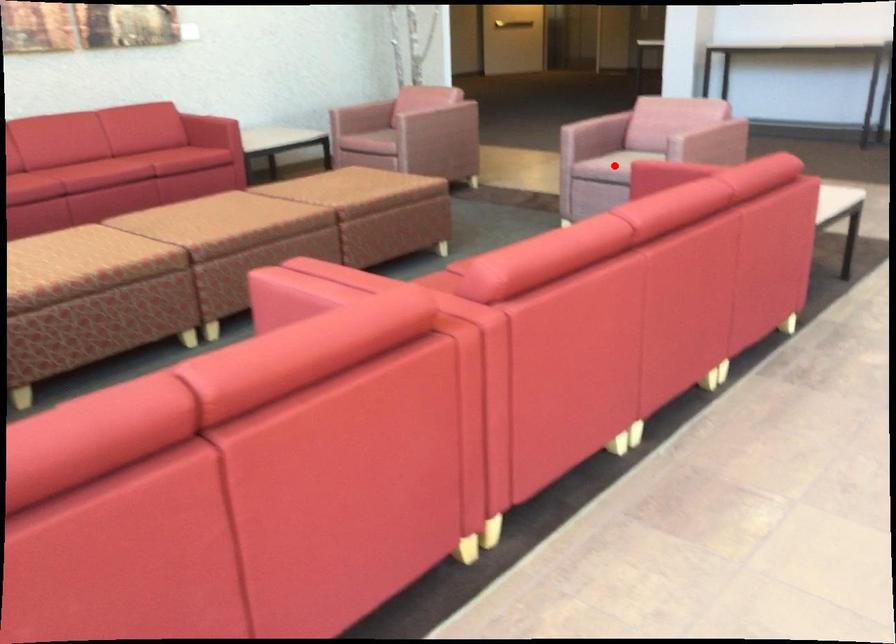
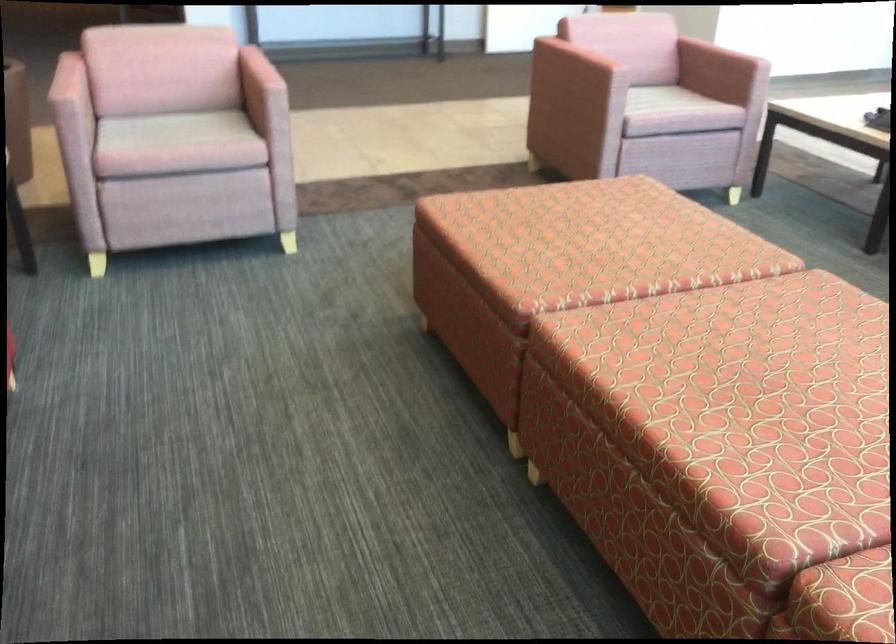
Question: I am providing you with two images of the same scene from different viewpoints. A red point is marked on the first image. Is the red point's position out of view in image 2?

Choices:
 (A) Yes
 (B) No

Answer: (A)